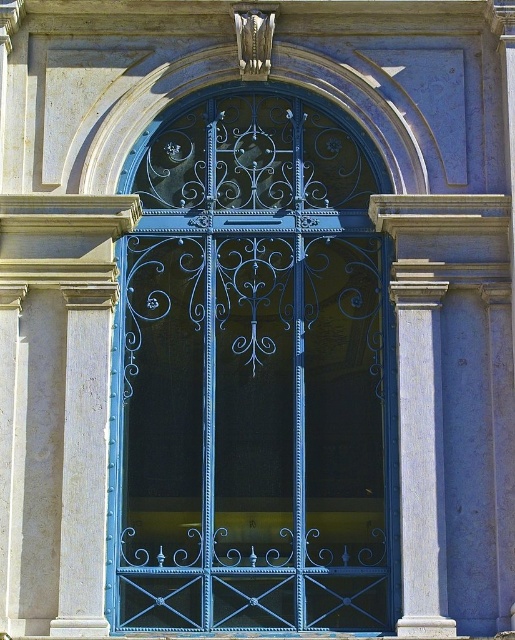
Question: Is white marble column at right above smooth stone column at left?

Choices:
 (A) yes
 (B) no

Answer: (A)

Question: Does blue wrought iron door at center have a larger size compared to smooth stone column at left?

Choices:
 (A) yes
 (B) no

Answer: (A)

Question: Among these points, which one is nearest to the camera?

Choices:
 (A) (94, 413)
 (B) (371, 304)

Answer: (A)

Question: Among these objects, which one is nearest to the camera?

Choices:
 (A) blue wrought iron door at center
 (B) smooth stone column at left
 (C) white marble column at right

Answer: (C)

Question: Which point appears farthest from the camera in this image?

Choices:
 (A) (79, 524)
 (B) (283, 184)
 (C) (427, 449)

Answer: (B)

Question: Does white marble column at right appear on the left side of smooth stone column at left?

Choices:
 (A) yes
 (B) no

Answer: (B)